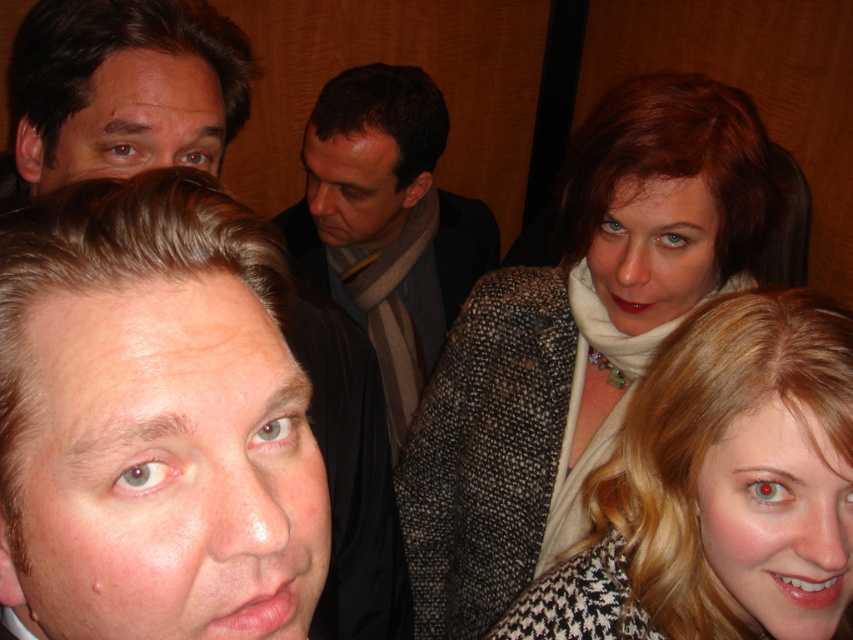
This screenshot has width=853, height=640. What do you see at coordinates (572, 337) in the screenshot?
I see `speckled wool coat at upper right` at bounding box center [572, 337].

What do you see at coordinates (572, 337) in the screenshot? Image resolution: width=853 pixels, height=640 pixels. I see `speckled wool coat at upper right` at bounding box center [572, 337].

You are a GUI agent. You are given a task and a screenshot of the screen. Output one action in this format:
    pyautogui.click(x=<x>, y=<y>)
    Task: Click on the speckled wool coat at upper right
    The width and height of the screenshot is (853, 640).
    Given the screenshot: What is the action you would take?
    pyautogui.click(x=572, y=337)

Is blonde hair at upper right smaller than dark gray scarf at center?

Yes.

Which is below, blonde hair at upper right or dark gray scarf at center?

blonde hair at upper right

Find the location of `blonde hair at upper right`. blonde hair at upper right is located at coordinates (711, 484).

Between point (554, 476) and point (796, 321), which one is positioned in front?

Point (796, 321)

What do you see at coordinates (572, 337) in the screenshot? The height and width of the screenshot is (640, 853). I see `speckled wool coat at upper right` at bounding box center [572, 337].

Where is `speckled wool coat at upper right`? The width and height of the screenshot is (853, 640). speckled wool coat at upper right is located at coordinates pyautogui.click(x=572, y=337).